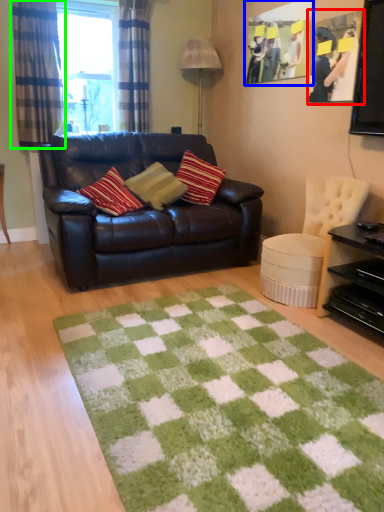
Question: Estimate the real-world distances between objects in this image. Which object is farther from picture frame (highlighted by a red box), picture frame (highlighted by a blue box) or curtain (highlighted by a green box)?

Choices:
 (A) picture frame
 (B) curtain

Answer: (B)